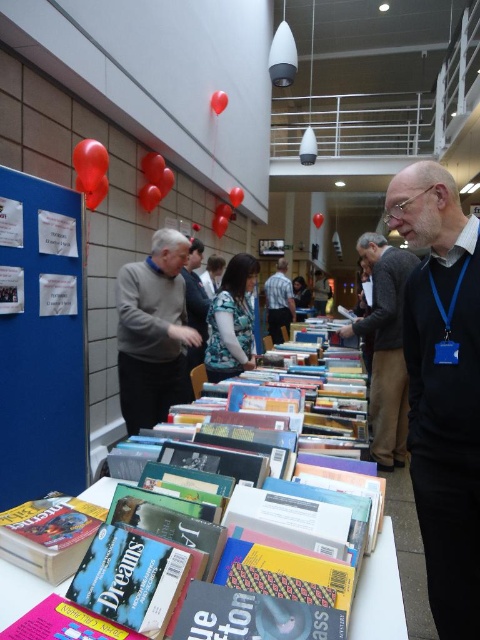
You are standing in the bookstore and see two points marked on the floor. The first point is at coordinate point (372, 332) and the second is at point (396, 637). Which point is closer to you?

Point (372, 332) is closer to you because it is further to the viewer than point (396, 637).

You are a customer in the bookstore and want to know which of the two blue items at the center is shorter. Can you identify which one is shorter between the blue textured blouse at center and the blue fabric shirt at center?

The blue textured blouse at center is shorter than the blue fabric shirt at center.